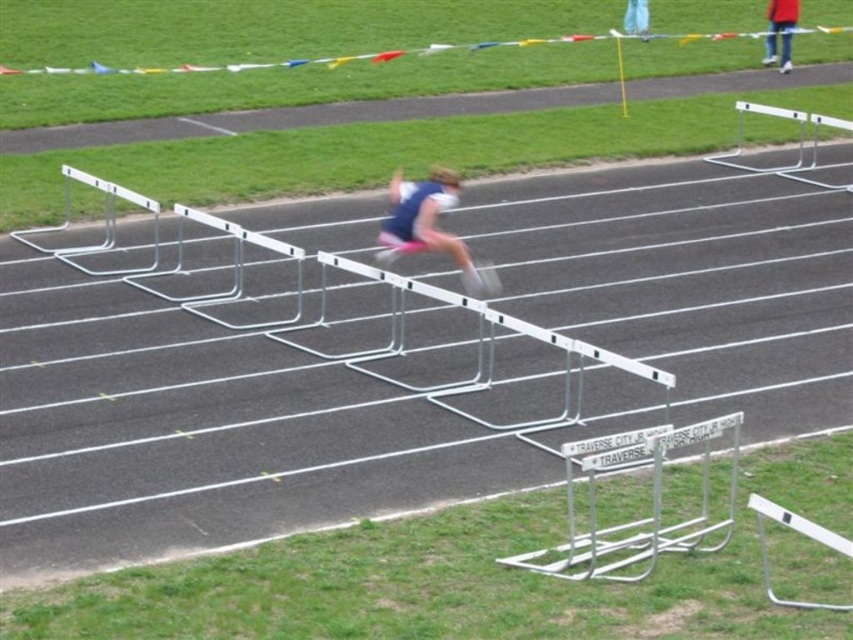
Question: Which point is farther to the camera?

Choices:
 (A) (630, 1)
 (B) (677, 445)

Answer: (A)

Question: Can you confirm if silver metallic hurdle at center is positioned above white fabric at upper center?

Choices:
 (A) yes
 (B) no

Answer: (B)

Question: Which of the following is the closest to the observer?

Choices:
 (A) (436, 179)
 (B) (627, 8)
 (C) (772, 19)
 (D) (698, 512)

Answer: (D)

Question: Which object appears closest to the camera in this image?

Choices:
 (A) silver metallic hurdle at center
 (B) white fabric at upper center

Answer: (A)

Question: Does blue fabric athlete at center appear on the right side of white fabric at upper center?

Choices:
 (A) yes
 (B) no

Answer: (B)

Question: Observing the image, what is the correct spatial positioning of silver metallic hurdle at center in reference to blue fabric athlete at center?

Choices:
 (A) below
 (B) above

Answer: (A)